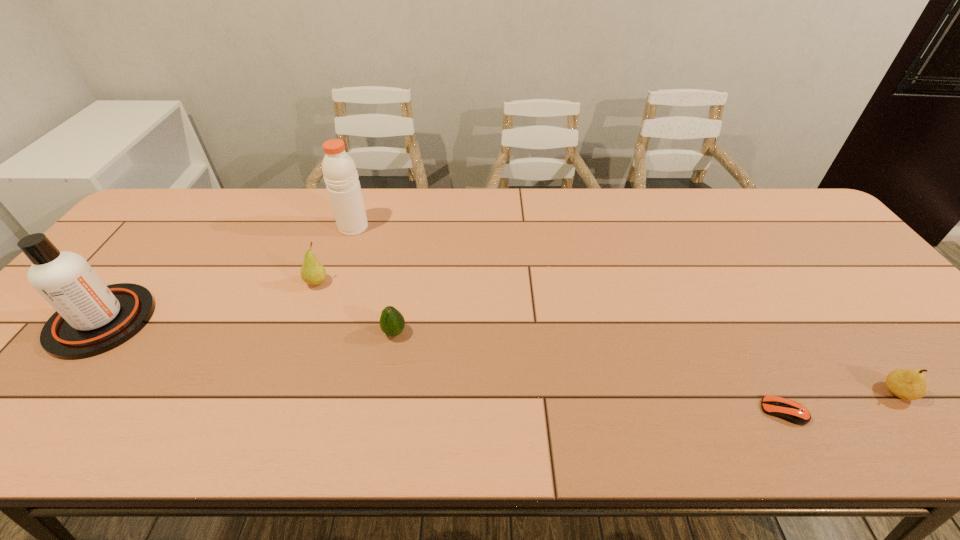
This screenshot has height=540, width=960. I want to click on free space between the avocado and the taller pear, so click(355, 308).

Where is `empty space between the leftmost object and the computer mouse`? This screenshot has width=960, height=540. empty space between the leftmost object and the computer mouse is located at coordinates click(x=443, y=366).

Find the location of a particular element. empty location between the farthest object and the nearer pear is located at coordinates (625, 309).

Identify the location of free space between the nearer pear and the farther pear. The image size is (960, 540). (607, 338).

Where is `free spot between the right pear and the shortest object`? Image resolution: width=960 pixels, height=540 pixels. free spot between the right pear and the shortest object is located at coordinates (840, 402).

This screenshot has height=540, width=960. What are the coordinates of `free space between the cleansing agent and the rightmost object` in the screenshot? It's located at (499, 356).

The image size is (960, 540). Find the location of `the second closest object relative to the avocado`. the second closest object relative to the avocado is located at coordinates (339, 170).

Locate an element on the screen. This screenshot has width=960, height=540. object that stands as the second closest to the fourth shortest object is located at coordinates (392, 323).

At what (x,y) coordinates should I click in order to perform the action: click on vacant point that satisfies the following two spatial constraints: 1. on the front side of the shortest object; 2. on the left side of the leftmost object. Please return your answer as a coordinate pair (x, y). Looking at the image, I should click on (29, 411).

You are a GUI agent. You are given a task and a screenshot of the screen. Output one action in this format:
    pyautogui.click(x=<x>, y=<y>)
    Task: Click on the vacant area that satisfies the following two spatial constraints: 1. on the front side of the fourth object from left to right; 2. on the right side of the computer mouse
    
    Given the screenshot: What is the action you would take?
    pyautogui.click(x=380, y=411)